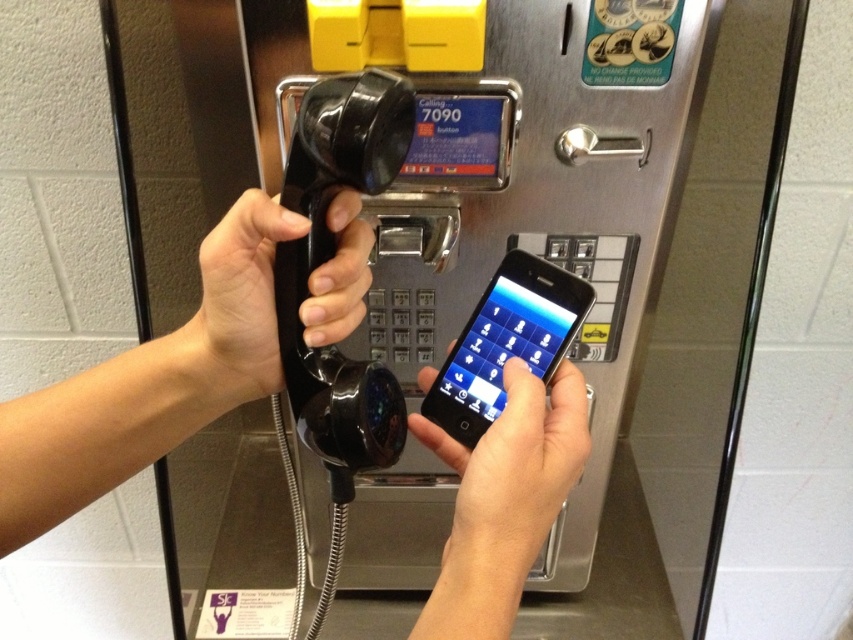
Who is lower down, black rubberized phone at center or black glossy smartphone at center?

black glossy smartphone at center

Between black rubberized phone at center and black glossy smartphone at center, which one appears on the right side from the viewer's perspective?

Positioned to the right is black glossy smartphone at center.

Is point (276, 365) farther from camera compared to point (502, 336)?

No.

The width and height of the screenshot is (853, 640). In order to click on black rubberized phone at center in this screenshot , I will do `click(236, 305)`.

Does black matte phone at center appear on the right side of matte black phone at center?

No, black matte phone at center is not to the right of matte black phone at center.

Who is lower down, black matte phone at center or matte black phone at center?

Positioned lower is matte black phone at center.

Locate an element on the screen. black matte phone at center is located at coordinates (149, 384).

Does metallic gray payphone at center have a greater height compared to matte black phone at center?

Indeed, metallic gray payphone at center has a greater height compared to matte black phone at center.

Is point (645, 86) less distant than point (514, 561)?

No, (645, 86) is further to viewer.

Find the location of a particular element. This screenshot has height=640, width=853. metallic gray payphone at center is located at coordinates tap(543, 200).